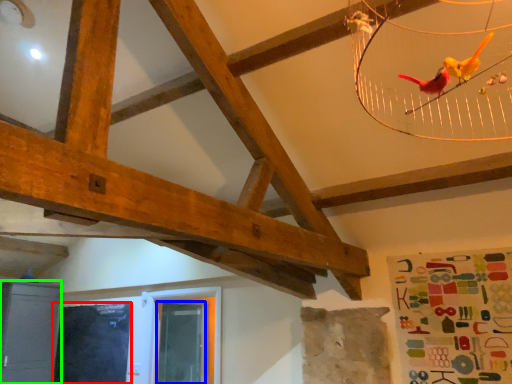
Question: Based on their relative distances, which object is farther from window screen (highlighted by a red box)? Choose from window screen (highlighted by a blue box) and furniture (highlighted by a green box).

Choices:
 (A) window screen
 (B) furniture

Answer: (A)